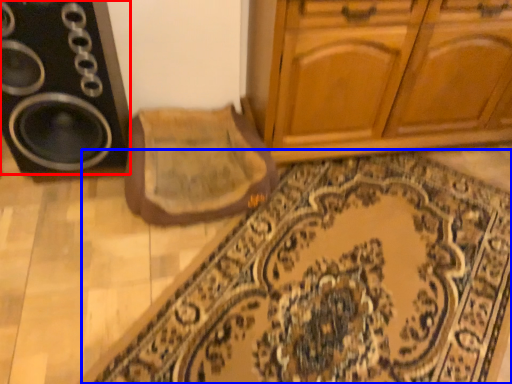
Question: Among these objects, which one is nearest to the camera, speaker (highlighted by a red box) or doormat (highlighted by a blue box)?

Choices:
 (A) speaker
 (B) doormat

Answer: (B)